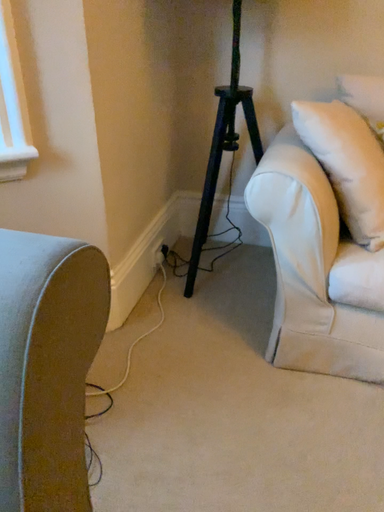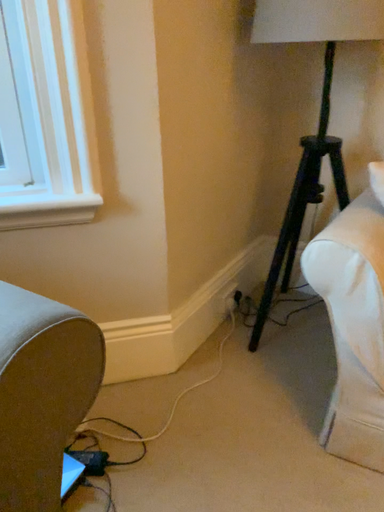
Question: Which way did the camera rotate in the video?

Choices:
 (A) rotated right
 (B) rotated left

Answer: (B)